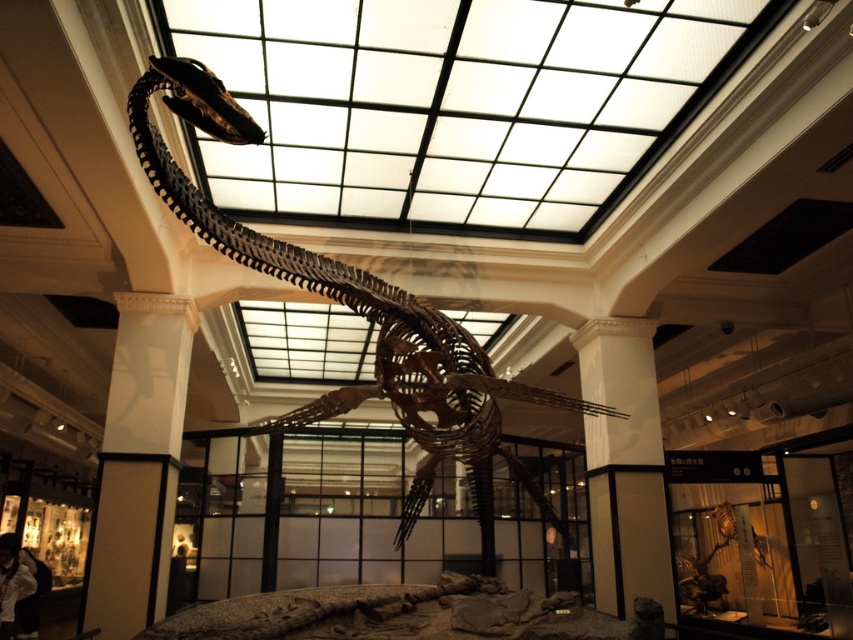
Question: Is brown wooden skeleton at center further to the viewer compared to white smooth pillar at center?

Choices:
 (A) yes
 (B) no

Answer: (B)

Question: Considering the relative positions of white glossy pillar at lower left and white smooth pillar at center in the image provided, where is white glossy pillar at lower left located with respect to white smooth pillar at center?

Choices:
 (A) below
 (B) above

Answer: (B)

Question: Can you confirm if brown wooden skeleton at center is positioned below white glossy pillar at lower left?

Choices:
 (A) yes
 (B) no

Answer: (B)

Question: Which object is farther from the camera taking this photo?

Choices:
 (A) white glossy pillar at lower left
 (B) white smooth pillar at center

Answer: (B)

Question: Which object appears farthest from the camera in this image?

Choices:
 (A) white smooth pillar at center
 (B) brown wooden skeleton at center
 (C) white glossy pillar at lower left

Answer: (A)

Question: Which of the following is the farthest from the observer?

Choices:
 (A) white glossy pillar at lower left
 (B) brown wooden skeleton at center

Answer: (A)